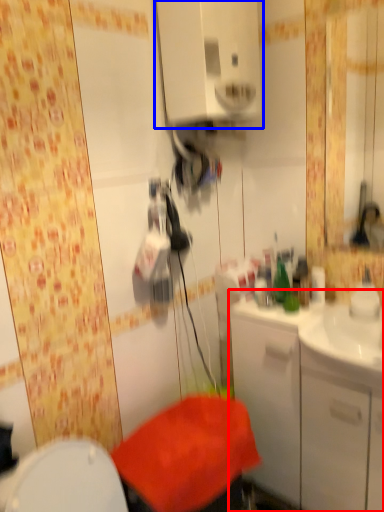
Question: Which object appears farthest to the camera in this image, bathroom cabinet (highlighted by a red box) or medicine cabinet (highlighted by a blue box)?

Choices:
 (A) bathroom cabinet
 (B) medicine cabinet

Answer: (A)